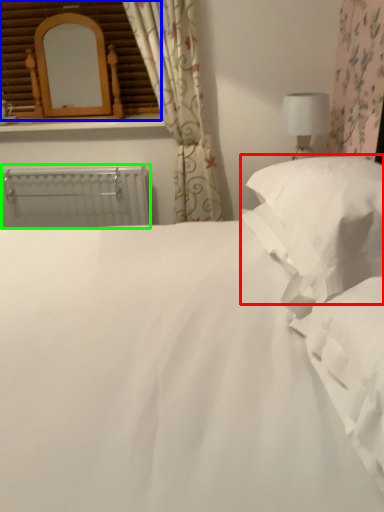
Question: Which is nearer to the pillow (highlighted by a red box)? window frame (highlighted by a blue box) or radiator (highlighted by a green box).

Choices:
 (A) window frame
 (B) radiator

Answer: (B)